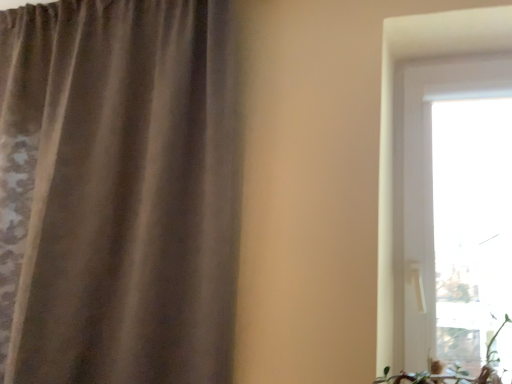
The image size is (512, 384). Identify the location of brown fabric curtain at left. (117, 192).

The width and height of the screenshot is (512, 384). What do you see at coordinates (117, 192) in the screenshot? I see `brown fabric curtain at left` at bounding box center [117, 192].

This screenshot has width=512, height=384. Find the location of `brown fabric curtain at left`. brown fabric curtain at left is located at coordinates (117, 192).